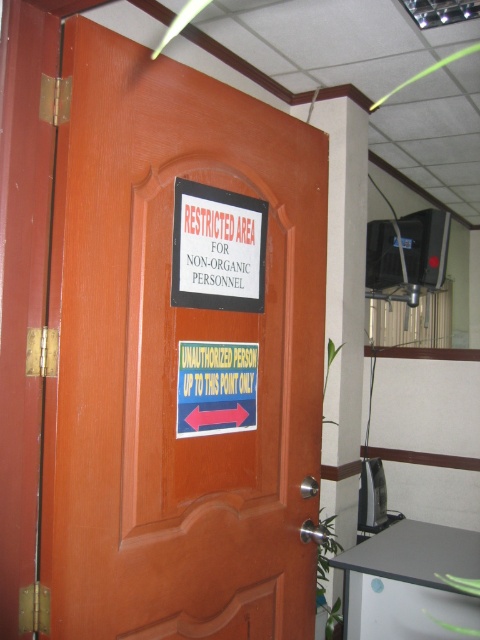
Question: Does brown wooden door at center have a lesser width compared to white paper sign at center?

Choices:
 (A) no
 (B) yes

Answer: (A)

Question: Does brown wooden door at center lie in front of white paper sign at center?

Choices:
 (A) no
 (B) yes

Answer: (B)

Question: Where is brown wooden door at center located in relation to white paper sign at center in the image?

Choices:
 (A) left
 (B) right

Answer: (B)

Question: Which point is farther to the camera?

Choices:
 (A) brown wooden door at center
 (B) white paper sign at center

Answer: (B)

Question: Which of the following is the closest to the observer?

Choices:
 (A) (207, 304)
 (B) (84, 296)

Answer: (B)